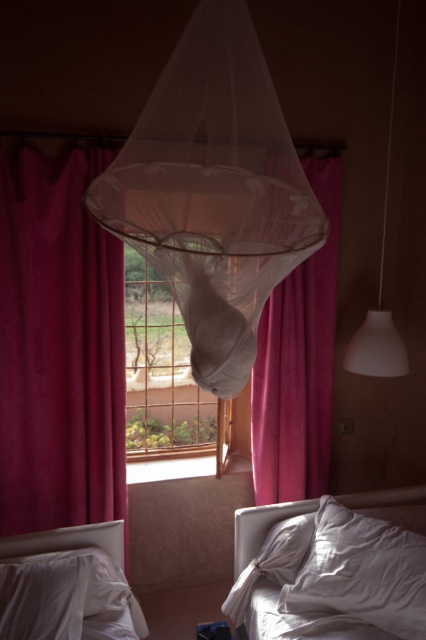
Question: Can you confirm if velvet magenta curtain at left is positioned to the left of white soft bed at lower left?

Choices:
 (A) no
 (B) yes

Answer: (B)

Question: Which object is the closest to the metallic wire mesh at center?

Choices:
 (A) white soft bed at lower left
 (B) white soft pillow at lower left
 (C) white soft pillow at lower center
 (D) velvet pink curtain at center

Answer: (D)

Question: Estimate the real-world distances between objects in this image. Which object is farther from the white soft bed at lower left?

Choices:
 (A) metallic wire mesh at center
 (B) white soft pillow at lower center
 (C) white matte lampshade at right
 (D) white soft bed at lower right

Answer: (C)

Question: Can you confirm if white soft bed at lower right is wider than white soft bedsheet at lower center?

Choices:
 (A) no
 (B) yes

Answer: (B)

Question: Estimate the real-world distances between objects in this image. Which object is closer to the velvet magenta curtain at left?

Choices:
 (A) white soft bed at lower left
 (B) white matte lampshade at right
 (C) white soft bed at lower right
 (D) white soft pillow at lower left

Answer: (A)

Question: Can you confirm if velvet magenta curtain at left is positioned below metallic wire mesh at center?

Choices:
 (A) yes
 (B) no

Answer: (A)